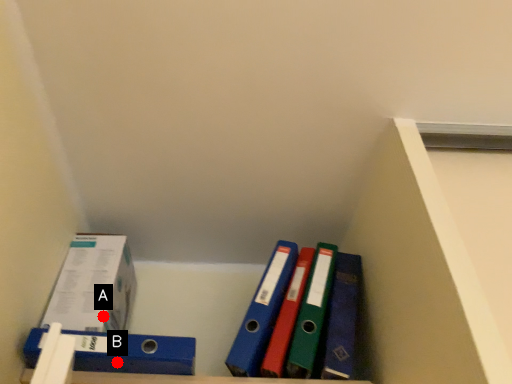
Question: Two points are circled on the image, labeled by A and B beside each circle. Which point is farther from the camera taking this photo?

Choices:
 (A) A is further
 (B) B is further

Answer: (A)